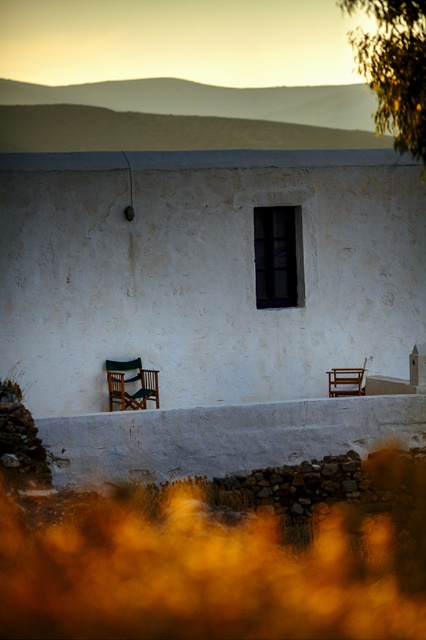
You are planning to place a rectangular table between the wooden folding chair at lower left and the wooden chair at lower right. Based on the scene description, which chair has a larger width that could affect the table placement?

The wooden folding chair at lower left might be wider than the wooden chair at lower right, so it could require more space when placing the table between them.